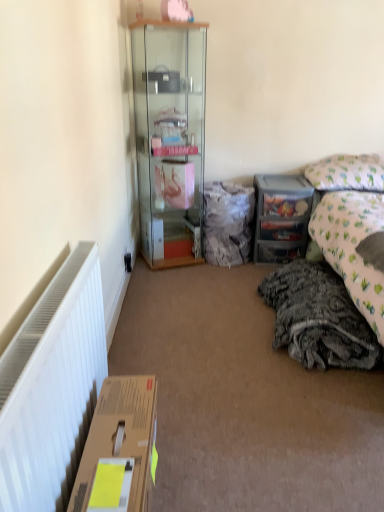
Question: From the image's perspective, is fuzzy fabric bag at center under brown cardboard box at lower left?

Choices:
 (A) no
 (B) yes

Answer: (A)

Question: Considering the relative sizes of fuzzy fabric bag at center and brown cardboard box at lower left in the image provided, is fuzzy fabric bag at center thinner than brown cardboard box at lower left?

Choices:
 (A) yes
 (B) no

Answer: (B)

Question: Does fuzzy fabric bag at center have a lesser height compared to brown cardboard box at lower left?

Choices:
 (A) no
 (B) yes

Answer: (A)

Question: Is fuzzy fabric bag at center directly adjacent to brown cardboard box at lower left?

Choices:
 (A) yes
 (B) no

Answer: (B)

Question: Is fuzzy fabric bag at center smaller than brown cardboard box at lower left?

Choices:
 (A) no
 (B) yes

Answer: (A)

Question: From a real-world perspective, is fuzzy fabric bag at center physically above brown cardboard box at lower left?

Choices:
 (A) yes
 (B) no

Answer: (A)

Question: Is clear plastic drawers at center right positioned beyond the bounds of transparent glass cabinet at center?

Choices:
 (A) yes
 (B) no

Answer: (A)

Question: Would you say clear plastic drawers at center right contains transparent glass cabinet at center?

Choices:
 (A) no
 (B) yes

Answer: (A)

Question: Does clear plastic drawers at center right have a smaller size compared to transparent glass cabinet at center?

Choices:
 (A) yes
 (B) no

Answer: (A)

Question: From a real-world perspective, is clear plastic drawers at center right positioned under transparent glass cabinet at center based on gravity?

Choices:
 (A) yes
 (B) no

Answer: (A)

Question: From the image's perspective, is clear plastic drawers at center right on top of transparent glass cabinet at center?

Choices:
 (A) yes
 (B) no

Answer: (B)

Question: Is clear plastic drawers at center right directly adjacent to transparent glass cabinet at center?

Choices:
 (A) no
 (B) yes

Answer: (A)

Question: Is brown cardboard box at lower left oriented towards clear plastic drawers at center right?

Choices:
 (A) yes
 (B) no

Answer: (B)